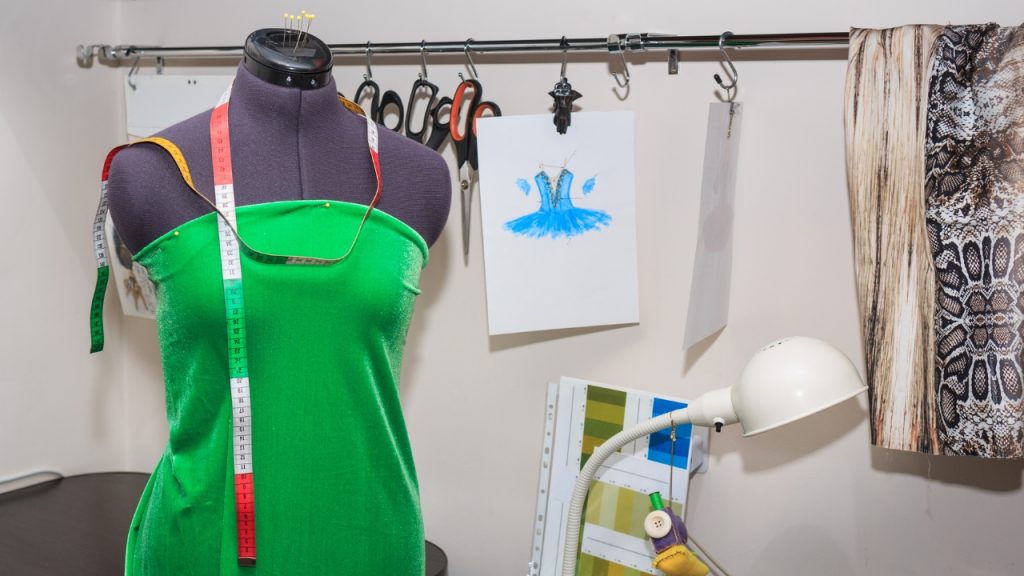
Identify every occurrence of how you hang things from the shelf in the image. Your answer should be formatted as a list of tuples, i.e. [(x1, y1), (x2, y2), ...], where each tuple contains the x and y coordinates of a point satisfying the conditions above.

[(729, 62), (626, 73), (560, 67), (474, 71), (423, 72), (368, 74)]